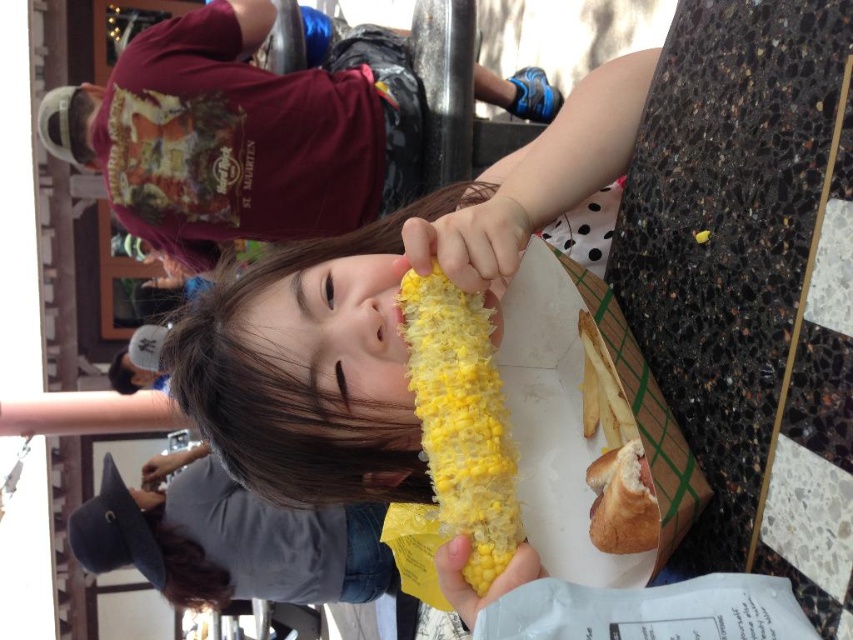
Question: Is yellow matte corn at center below golden bread hot dog at lower right?

Choices:
 (A) yes
 (B) no

Answer: (B)

Question: Among these points, which one is nearest to the camera?

Choices:
 (A) (598, 518)
 (B) (463, 364)

Answer: (A)

Question: Which object appears farthest from the camera in this image?

Choices:
 (A) yellow matte corn at center
 (B) golden bread hot dog at lower right

Answer: (A)

Question: Is yellow matte corn at center to the left of golden bread hot dog at lower right from the viewer's perspective?

Choices:
 (A) yes
 (B) no

Answer: (A)

Question: Can you confirm if yellow matte corn at center is positioned to the right of golden bread hot dog at lower right?

Choices:
 (A) yes
 (B) no

Answer: (B)